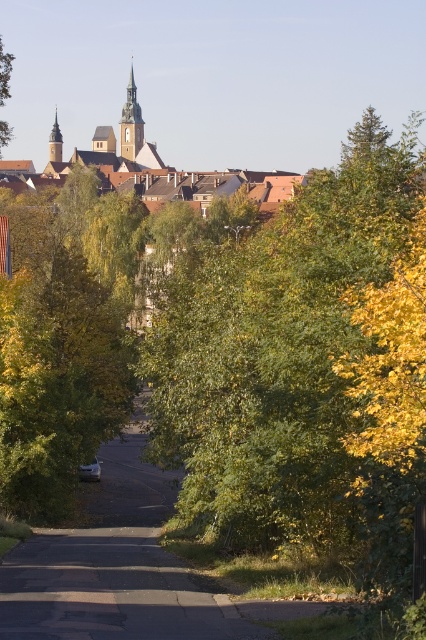
You are a tourist walking along the white asphalt road at center and want to take a photo of the green leafy tree at upper left. In which direction should you move to get the tree in your camera frame?

The white asphalt road at center is to the right of green leafy tree at upper left, so you should move to your left to position the green leafy tree at upper left within your camera frame.

You are a tourist standing on the pathway and want to take a photo of the brown tiled roofs at upper center without the white asphalt road at center blocking the view. Is this possible?

The white asphalt road at center is closer to the viewer than the brown tiled roofs at upper center, so the road will block the view of the roofs. To capture the roofs without the road in the foreground, you would need to position yourself behind the road or adjust your angle to frame the shot around the road.

You are an architect designing a new park and want to incorporate elements from this scene. If you want to ensure that the brown tiled roofs at upper center are visually dominant over the green leafy tree at upper left, how should you arrange their widths?

To make the brown tiled roofs at upper center visually dominant over the green leafy tree at upper left, you should design the brown tiled roofs at upper center to be wider than the green leafy tree at upper left since the brown tiled roofs at upper center are already wider according to the scene description.